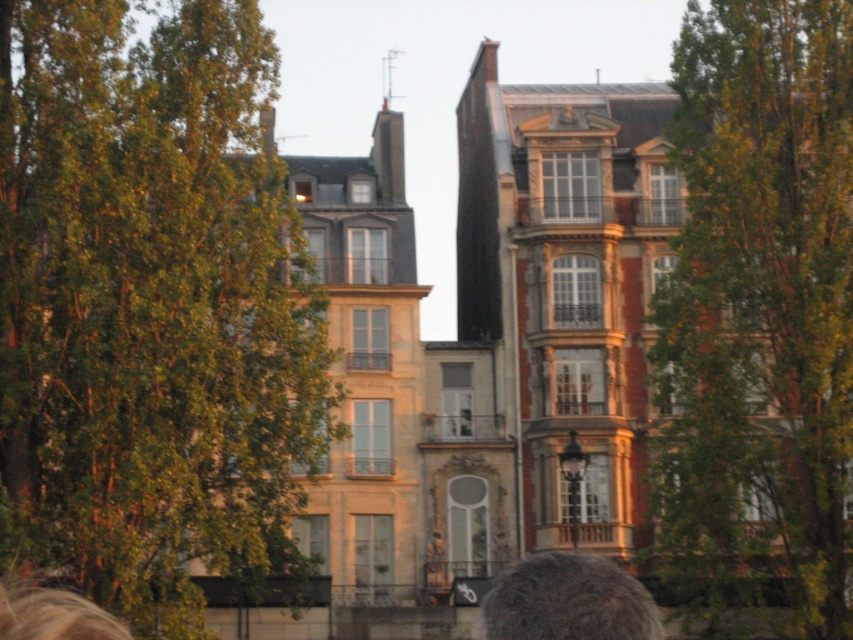
Consider the image. You are a photographer planning to capture the European cityscape with both the green leafy tree at left and the green leafy tree at upper right in your shot. Which tree will appear bigger in your photo?

The green leafy tree at left will appear bigger in the photo because it is larger in size than the green leafy tree at upper right.

You are a photographer standing in front of the European buildings. You notice a gray hair at lower center and a green leafy tree at left. Which object is closer to you?

The green leafy tree at left is closer to you because the gray hair at lower center is behind it.

You are standing in front of the European buildings and want to determine the relative positions of two points marked in the scene. Which point is closer to you, point [717,598] or point [602,600]?

Point [717,598] is further to the viewer than point [602,600], so the closer point to you is point [602,600].